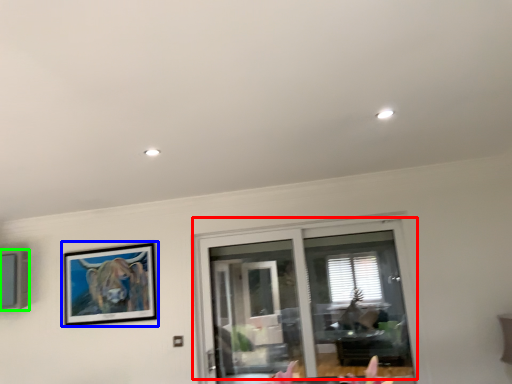
Question: Which is farther away from window (highlighted by a red box)? picture frame (highlighted by a blue box) or picture frame (highlighted by a green box)?

Choices:
 (A) picture frame
 (B) picture frame

Answer: (B)